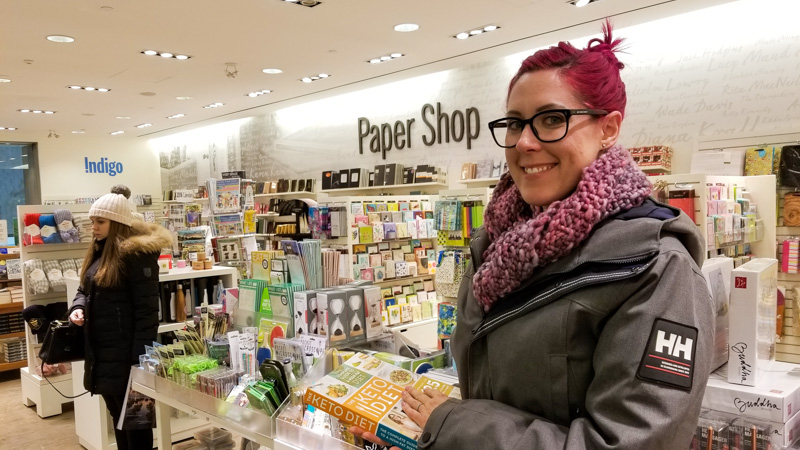
You are a GUI agent. You are given a task and a screenshot of the screen. Output one action in this format:
    pyautogui.click(x=<x>, y=<y>)
    Task: Click on the light
    This screenshot has width=800, height=450.
    Given the screenshot: What is the action you would take?
    pyautogui.click(x=174, y=56)